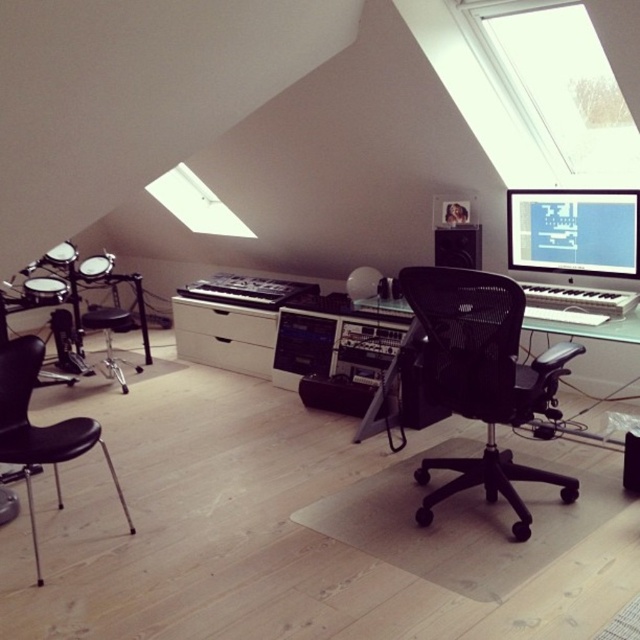
Question: Which point is closer to the camera?

Choices:
 (A) transparent glass window at upper center
 (B) black matte speaker at center
 (C) matte black monitor at upper right
 (D) white matte drawer at center

Answer: (A)

Question: Is black mesh office chair at center wider than black matte speaker at center?

Choices:
 (A) yes
 (B) no

Answer: (A)

Question: Can you confirm if transparent glass window at upper center is positioned to the left of matte black monitor at upper right?

Choices:
 (A) yes
 (B) no

Answer: (A)

Question: Which point is farther from the camera taking this photo?

Choices:
 (A) (58, 461)
 (B) (593, 241)

Answer: (B)

Question: Can you confirm if transparent glass window at upper center is thinner than matte black monitor at upper right?

Choices:
 (A) no
 (B) yes

Answer: (A)

Question: Which point is closer to the camera?

Choices:
 (A) black leather swivel chair at left
 (B) black matte speaker at center
 (C) white matte drawer at center

Answer: (A)